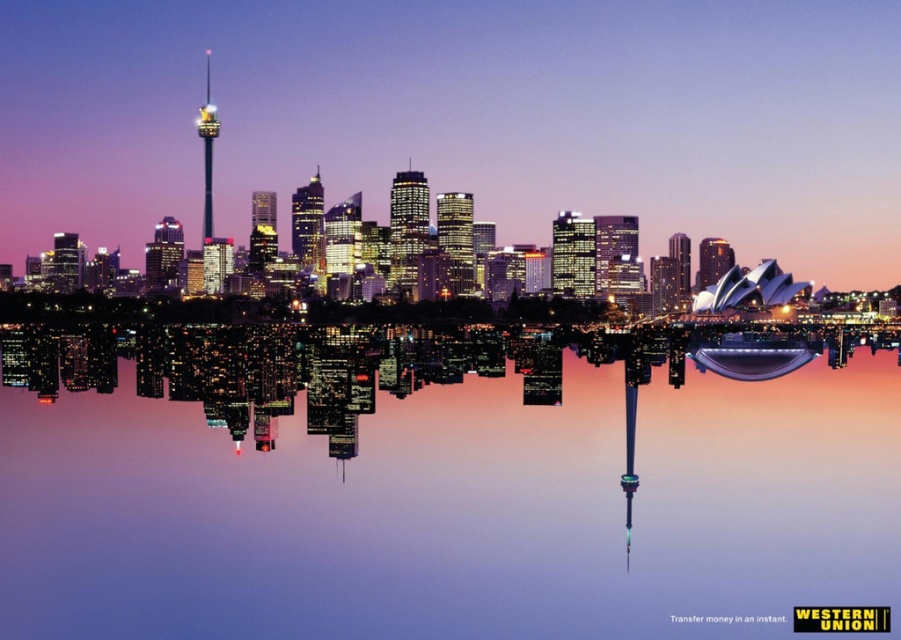
Is transparent glass water at center thinner than shiny glass tower at center?

Yes, transparent glass water at center is thinner than shiny glass tower at center.

Image resolution: width=901 pixels, height=640 pixels. What are the coordinates of `transparent glass water at center` in the screenshot? It's located at (444, 483).

Image resolution: width=901 pixels, height=640 pixels. Identify the location of transparent glass water at center. (444, 483).